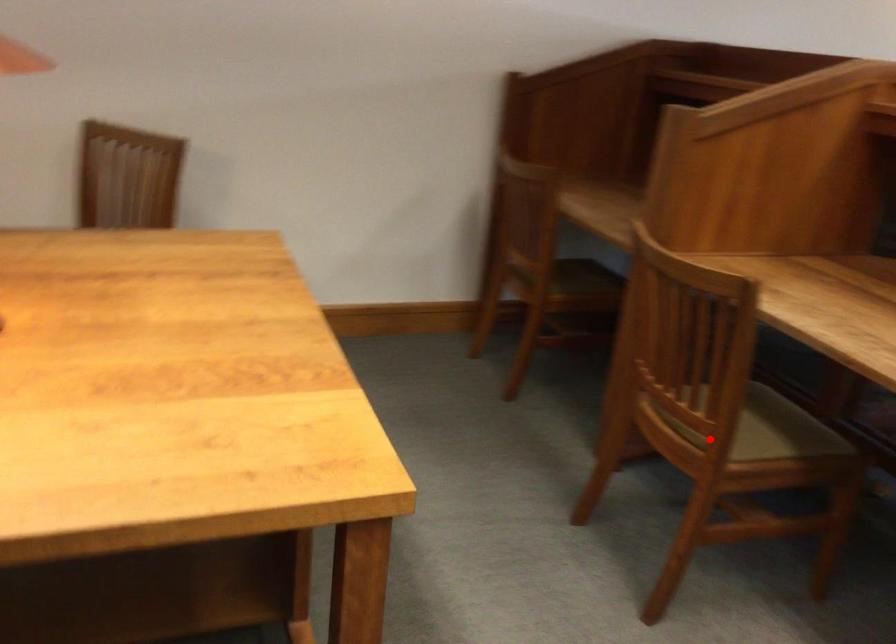
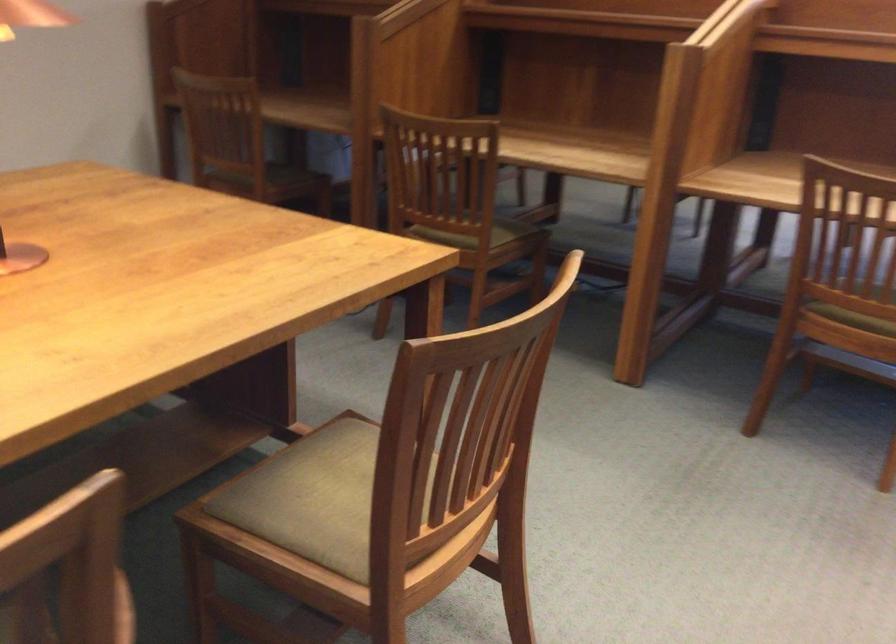
In the second image, find the point that corresponds to the highlighted location in the first image.

(474, 234)